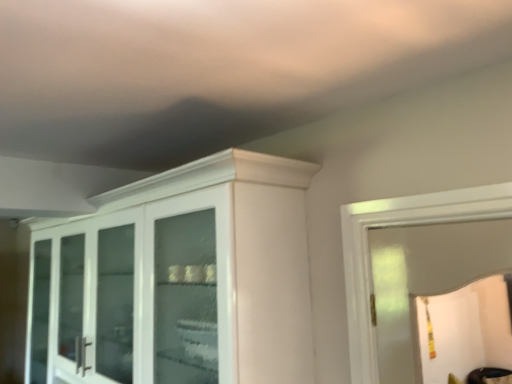
The width and height of the screenshot is (512, 384). I want to click on white glossy cabinet at upper left, so click(178, 279).

Describe the element at coordinates (178, 279) in the screenshot. I see `white glossy cabinet at upper left` at that location.

Locate an element on the screen. Image resolution: width=512 pixels, height=384 pixels. white glossy cabinet at upper left is located at coordinates (178, 279).